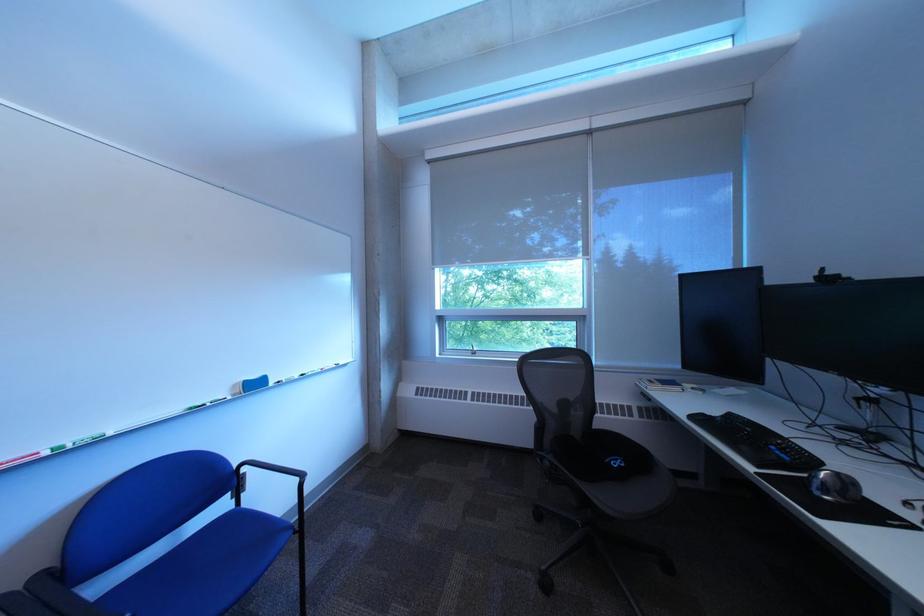
Find the location of a particular element. blue chair sitting surface is located at coordinates (204, 567).